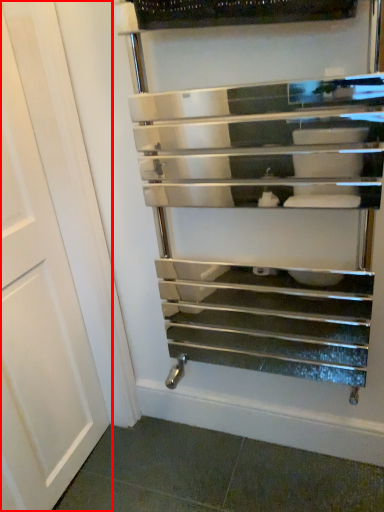
Question: From the image's perspective, what is the correct spatial relationship of door (annotated by the red box) in relation to shelf?

Choices:
 (A) below
 (B) above

Answer: (A)